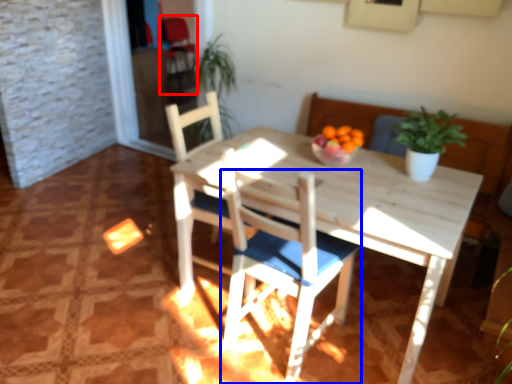
Question: Which object appears closest to the camera in this image, armchair (highlighted by a red box) or chair (highlighted by a blue box)?

Choices:
 (A) armchair
 (B) chair

Answer: (B)